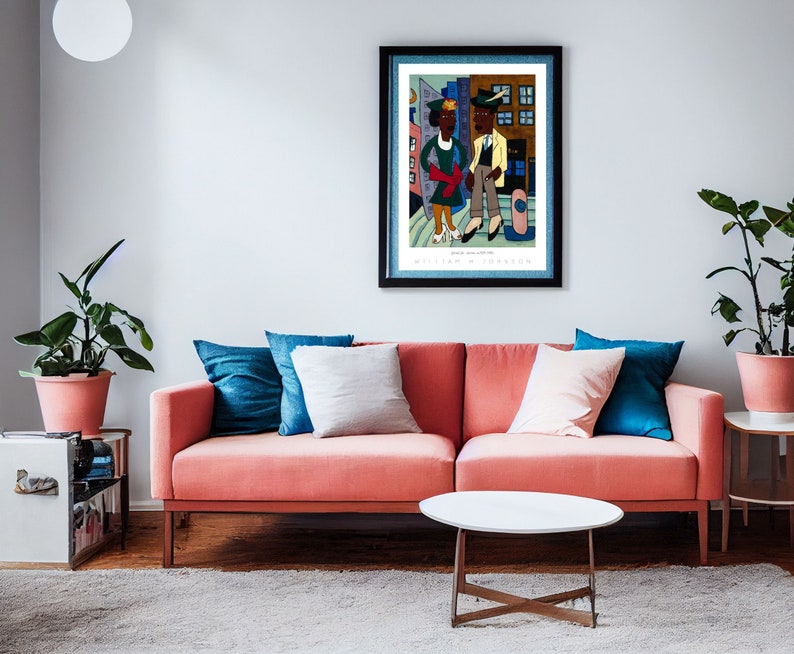
Identify the location of wood floors. (139, 549), (207, 539), (746, 553).